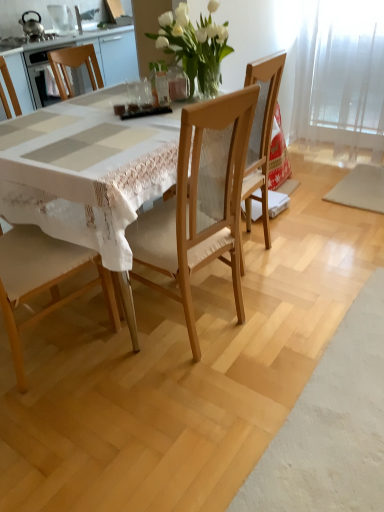
Find the location of `vacant space positioned to the left of clear glass at center`. vacant space positioned to the left of clear glass at center is located at coordinates (98, 106).